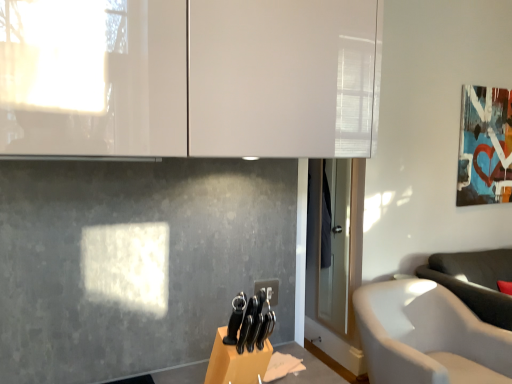
In order to face white fabric chair at lower right, should I rotate leftwards or rightwards?

It's best to rotate right around 23.154 degrees.

Image resolution: width=512 pixels, height=384 pixels. What do you see at coordinates (485, 146) in the screenshot?
I see `matte acrylic picture frame at upper right` at bounding box center [485, 146].

At what (x,y) coordinates should I click in order to perform the action: click on white glossy cabinet at upper center. Please return your answer as a coordinate pair (x, y). Looking at the image, I should click on (190, 77).

Does white fabric chair at lower right have a greater height compared to white glossy cabinet at upper center?

Yes.

Do you think white fabric chair at lower right is within white glossy cabinet at upper center, or outside of it?

white fabric chair at lower right lies outside white glossy cabinet at upper center.

Is there a large distance between white fabric chair at lower right and white glossy cabinet at upper center?

Absolutely, white fabric chair at lower right is distant from white glossy cabinet at upper center.

Does white fabric chair at lower right turn towards white glossy cabinet at upper center?

No, white fabric chair at lower right is not aimed at white glossy cabinet at upper center.

Is matte acrylic picture frame at upper right at the back of white glossy cabinet at upper center?

No.

Locate an element on the screen. Image resolution: width=512 pixels, height=384 pixels. picture frame above the white glossy cabinet at upper center (from the image's perspective) is located at coordinates (485, 146).

Between white glossy cabinet at upper center and matte acrylic picture frame at upper right, which one appears on the right side from the viewer's perspective?

From the viewer's perspective, matte acrylic picture frame at upper right appears more on the right side.

From the picture: Would you say matte acrylic picture frame at upper right is to the left or to the right of white glossy cabinet at upper center in the picture?

matte acrylic picture frame at upper right is to the right of white glossy cabinet at upper center.

Considering the sizes of objects matte acrylic picture frame at upper right and white glossy cabinet at upper center in the image provided, who is wider, matte acrylic picture frame at upper right or white glossy cabinet at upper center?

Wider between the two is white glossy cabinet at upper center.

From the picture: Can you confirm if matte acrylic picture frame at upper right is taller than white glossy cabinet at upper center?

Indeed, matte acrylic picture frame at upper right has a greater height compared to white glossy cabinet at upper center.

Could you measure the distance between matte acrylic picture frame at upper right and white glossy cabinet at upper center?

matte acrylic picture frame at upper right and white glossy cabinet at upper center are 9.26 feet apart from each other.

In the scene shown: Is white fabric chair at lower right located within white glossy cabinet at upper center?

That's incorrect, white fabric chair at lower right is not inside white glossy cabinet at upper center.

How much distance is there between white glossy cabinet at upper center and white fabric chair at lower right?

The distance of white glossy cabinet at upper center from white fabric chair at lower right is 5.58 feet.

Which is less distant, (195,17) or (399,327)?

Positioned in front is point (195,17).

From the image's perspective, which one is positioned lower, white glossy cabinet at upper center or white fabric chair at lower right?

white fabric chair at lower right appears lower in the image.

Would you consider matte acrylic picture frame at upper right to be distant from white fabric chair at lower right?

Indeed, matte acrylic picture frame at upper right is not near white fabric chair at lower right.

Considering the positions of objects matte acrylic picture frame at upper right and white fabric chair at lower right in the image provided, who is more to the left, matte acrylic picture frame at upper right or white fabric chair at lower right?

From the viewer's perspective, white fabric chair at lower right appears more on the left side.

Is matte acrylic picture frame at upper right situated inside white fabric chair at lower right or outside?

matte acrylic picture frame at upper right is not inside white fabric chair at lower right, it's outside.

Considering the relative sizes of white fabric chair at lower right and matte acrylic picture frame at upper right in the image provided, is white fabric chair at lower right shorter than matte acrylic picture frame at upper right?

Yes, white fabric chair at lower right is shorter than matte acrylic picture frame at upper right.

From a real-world perspective, who is located lower, white fabric chair at lower right or matte acrylic picture frame at upper right?

white fabric chair at lower right, from a real-world perspective.

Between point (419, 342) and point (471, 126), which one is positioned behind?

Point (471, 126)

This screenshot has width=512, height=384. What are the coordinates of `cabinetry lying in front of the white fabric chair at lower right` in the screenshot? It's located at pyautogui.click(x=190, y=77).

Where is `picture frame on the right of white glossy cabinet at upper center`? Image resolution: width=512 pixels, height=384 pixels. picture frame on the right of white glossy cabinet at upper center is located at coordinates (485, 146).

In the scene shown: Based on their spatial positions, is white fabric chair at lower right or white glossy cabinet at upper center closer to matte acrylic picture frame at upper right?

Based on the image, white fabric chair at lower right appears to be nearer to matte acrylic picture frame at upper right.

In the scene shown: Estimate the real-world distances between objects in this image. Which object is closer to matte acrylic picture frame at upper right, white glossy cabinet at upper center or white fabric chair at lower right?

white fabric chair at lower right is positioned closer to the anchor matte acrylic picture frame at upper right.

Which object lies further to the anchor point white fabric chair at lower right, white glossy cabinet at upper center or matte acrylic picture frame at upper right?

white glossy cabinet at upper center is further to white fabric chair at lower right.

Based on their spatial positions, is matte acrylic picture frame at upper right or white glossy cabinet at upper center closer to white fabric chair at lower right?

matte acrylic picture frame at upper right is positioned closer to the anchor white fabric chair at lower right.

Based on their spatial positions, is matte acrylic picture frame at upper right or white fabric chair at lower right closer to white glossy cabinet at upper center?

white fabric chair at lower right lies closer to white glossy cabinet at upper center than the other object.

Looking at the image, which one is located further to white glossy cabinet at upper center, white fabric chair at lower right or matte acrylic picture frame at upper right?

matte acrylic picture frame at upper right is further to white glossy cabinet at upper center.

At what (x,y) coordinates should I click in order to perform the action: click on chair between white glossy cabinet at upper center and matte acrylic picture frame at upper right from front to back. Please return your answer as a coordinate pair (x, y). The height and width of the screenshot is (384, 512). Looking at the image, I should click on (426, 336).